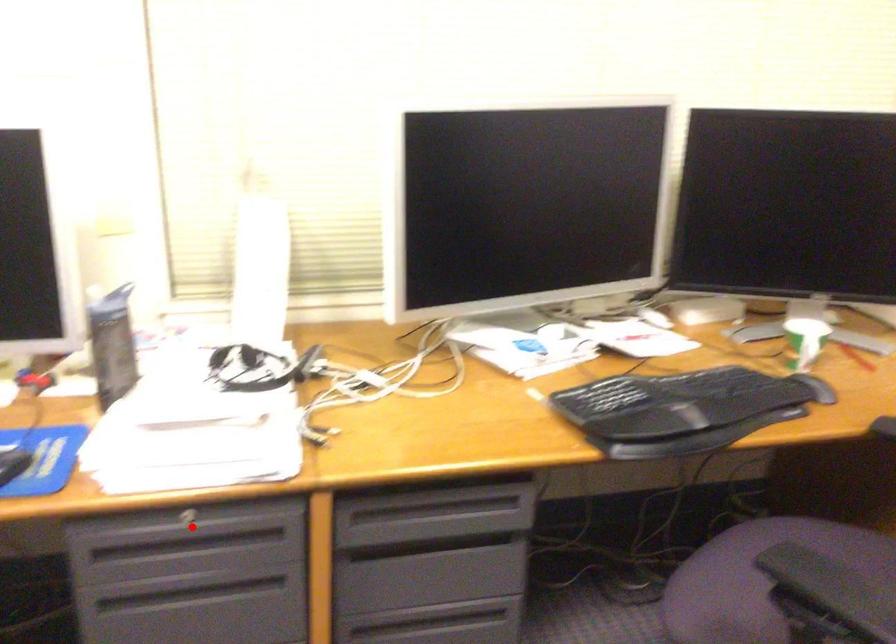
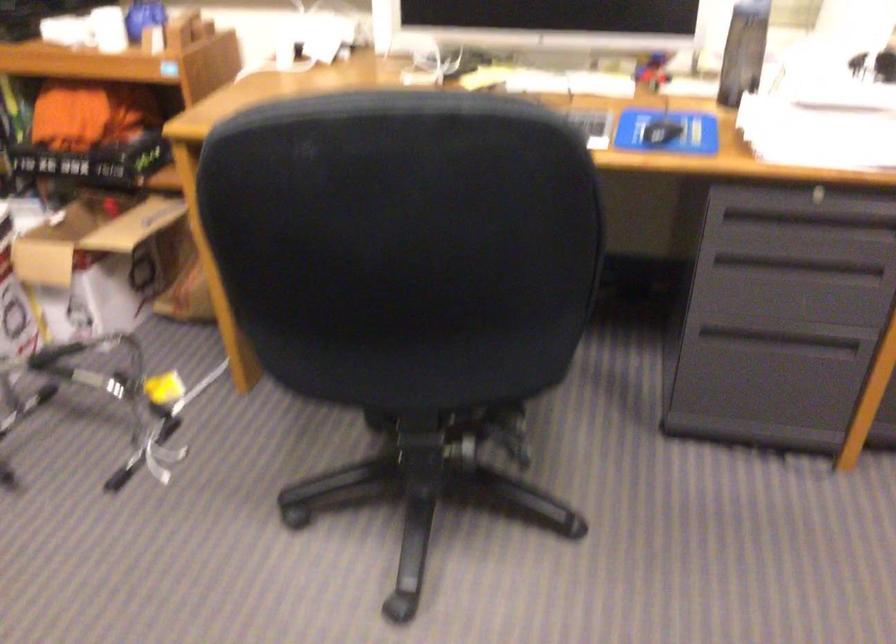
Question: I am providing you with two images of the same scene from different viewpoints. Image1 has a red point marked. In image2, the corresponding 3D location appears at what relative position? Reply with the corresponding letter.

Choices:
 (A) Closer
 (B) Farther

Answer: (B)